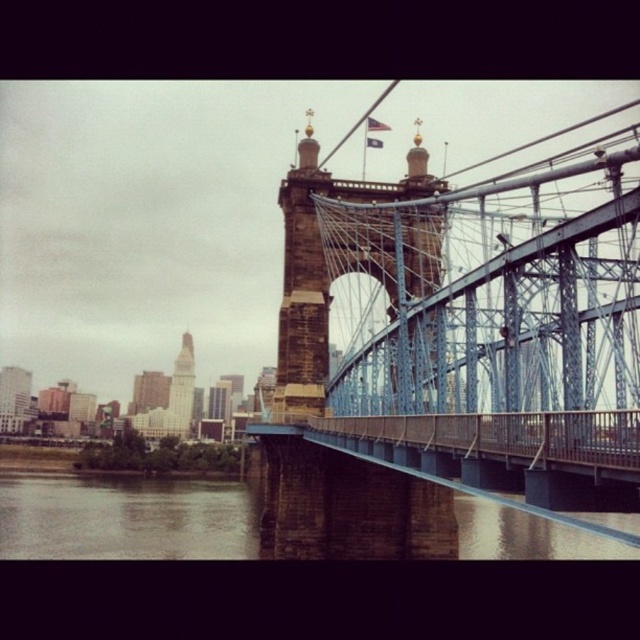
Question: Based on their relative distances, which object is farther from the brown stone river at lower center?

Choices:
 (A) matte glass skyscraper at left
 (B) blue steel suspension bridge at center

Answer: (A)

Question: Which point is closer to the camera taking this photo?

Choices:
 (A) (81, 524)
 (B) (451, 481)
 (C) (193, 362)
 (D) (4, 392)

Answer: (B)

Question: Is white glass skyscraper at center-left positioned at the back of matte glass skyscraper at left?

Choices:
 (A) no
 (B) yes

Answer: (A)

Question: Does blue steel suspension bridge at center appear on the right side of brown stone river at lower center?

Choices:
 (A) yes
 (B) no

Answer: (A)

Question: Which point is farther to the camera?

Choices:
 (A) matte glass skyscraper at left
 (B) blue steel suspension bridge at center
 (C) white glass skyscraper at center-left

Answer: (A)

Question: Does brown stone river at lower center have a smaller size compared to white glass skyscraper at center-left?

Choices:
 (A) no
 (B) yes

Answer: (A)